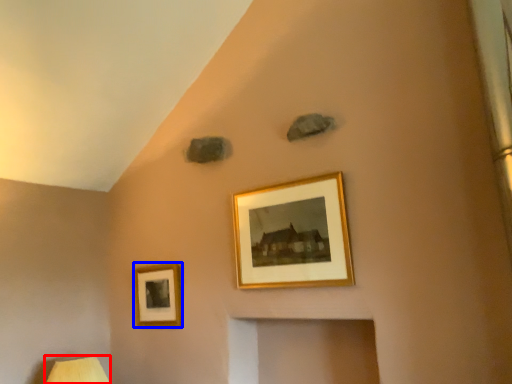
Question: Which point is closer to the camera, table lamp (highlighted by a red box) or picture frame (highlighted by a blue box)?

Choices:
 (A) table lamp
 (B) picture frame

Answer: (A)